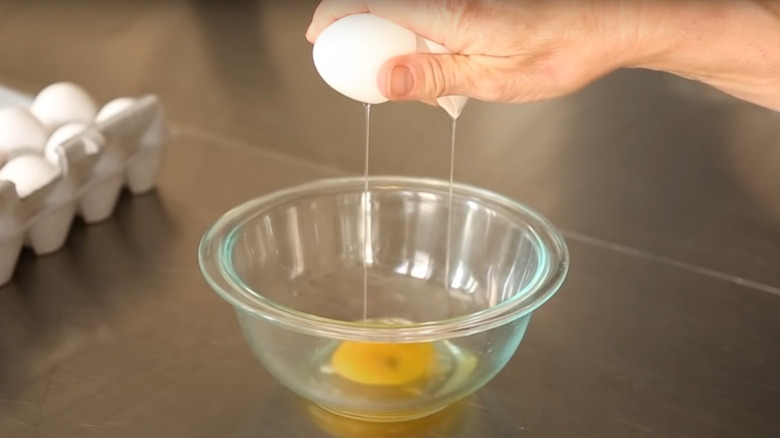
Identify the location of base of bowl. (388, 405).